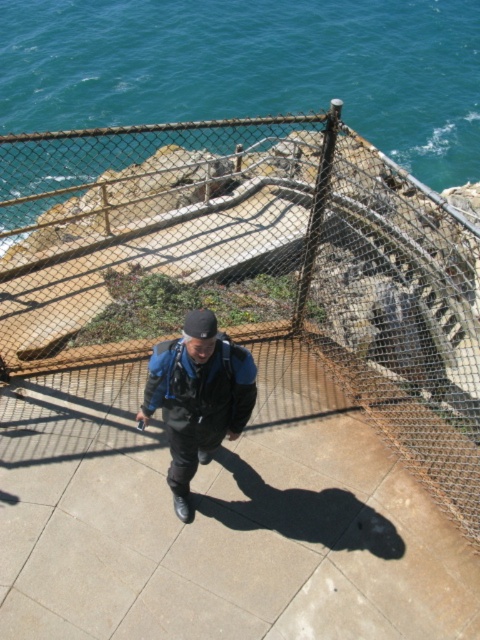
Question: Is teal water at upper left above black matte jacket at center?

Choices:
 (A) no
 (B) yes

Answer: (B)

Question: Which point is farther to the camera?

Choices:
 (A) rusty wire mesh at center
 (B) teal water at upper left

Answer: (B)

Question: Which object is the farthest from the teal water at upper left?

Choices:
 (A) rusty wire mesh at center
 (B) black matte jacket at center

Answer: (B)

Question: Can you confirm if rusty wire mesh at center is wider than black matte jacket at center?

Choices:
 (A) yes
 (B) no

Answer: (A)

Question: Can you confirm if teal water at upper left is smaller than black matte jacket at center?

Choices:
 (A) yes
 (B) no

Answer: (B)

Question: Estimate the real-world distances between objects in this image. Which object is closer to the rusty wire mesh at center?

Choices:
 (A) teal water at upper left
 (B) black matte jacket at center

Answer: (B)